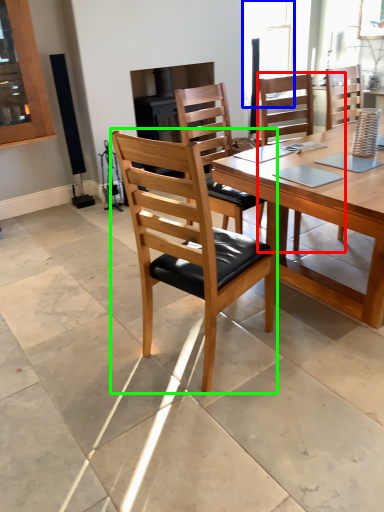
Question: Which is farther away from chair (highlighted by a red box)? window (highlighted by a blue box) or chair (highlighted by a green box)?

Choices:
 (A) window
 (B) chair

Answer: (A)